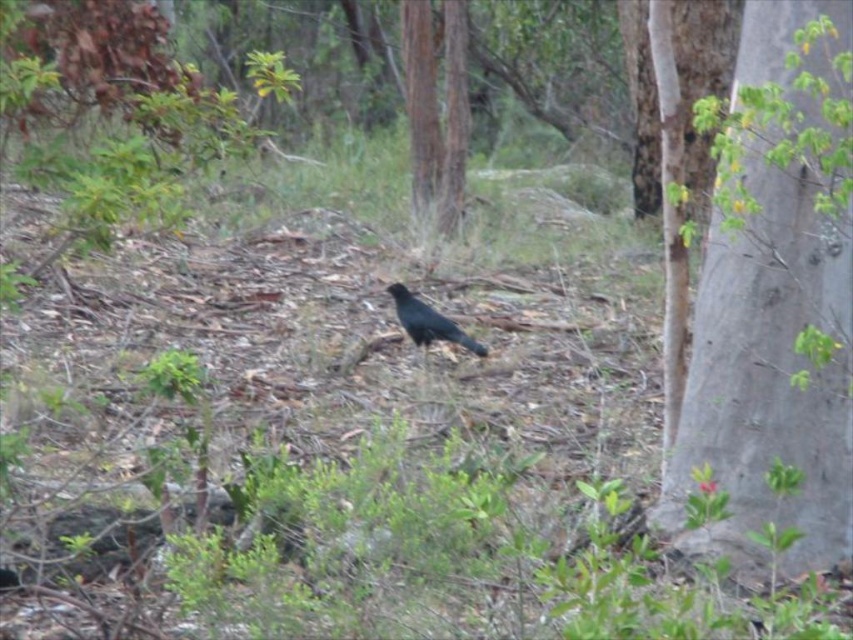
Question: Does smooth bark tree at center appear on the right side of shiny black bird at center?

Choices:
 (A) no
 (B) yes

Answer: (A)

Question: Estimate the real-world distances between objects in this image. Which object is closer to the shiny black bird at center?

Choices:
 (A) gray rough bark tree at right
 (B) smooth bark tree at center

Answer: (A)

Question: Does smooth bark tree at center have a lesser width compared to shiny black bird at center?

Choices:
 (A) yes
 (B) no

Answer: (A)

Question: Estimate the real-world distances between objects in this image. Which object is farther from the gray rough bark tree at right?

Choices:
 (A) shiny black bird at center
 (B) smooth bark tree at center

Answer: (B)

Question: In this image, where is gray rough bark tree at right located relative to smooth bark tree at center?

Choices:
 (A) left
 (B) right

Answer: (B)

Question: Which of the following is the closest to the observer?

Choices:
 (A) (466, 342)
 (B) (850, 499)
 (C) (418, 189)

Answer: (B)